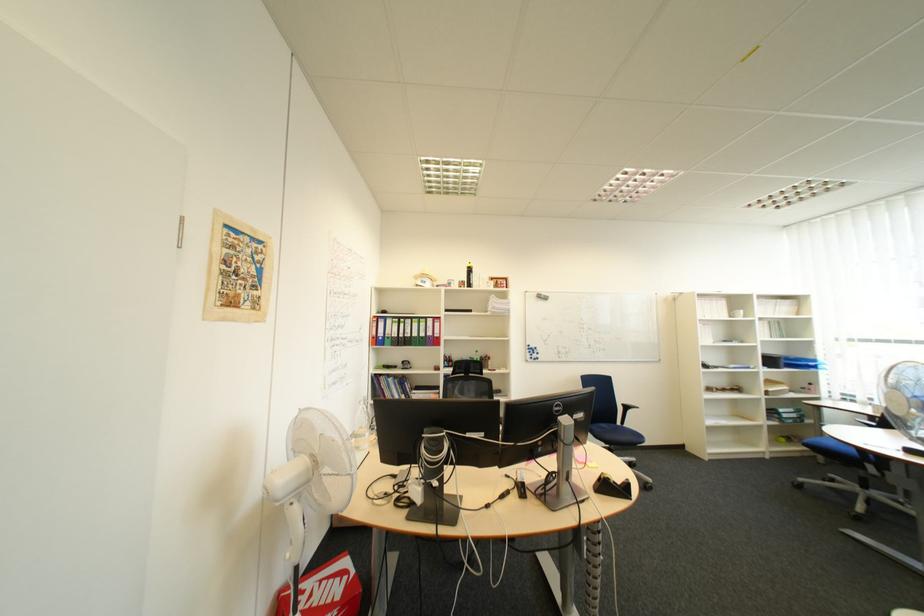
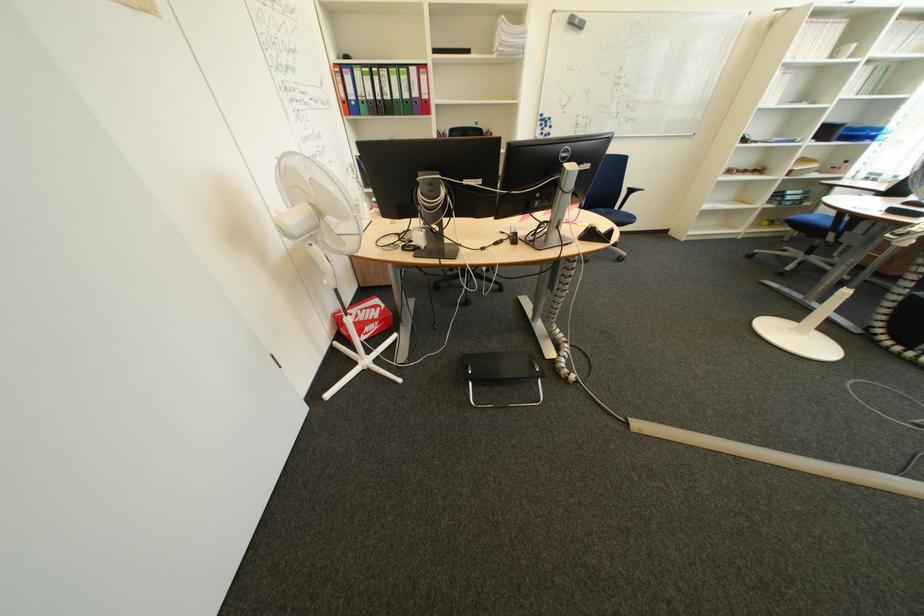
In the second image, find the point that corresponds to [593,416] in the first image.

(601, 168)